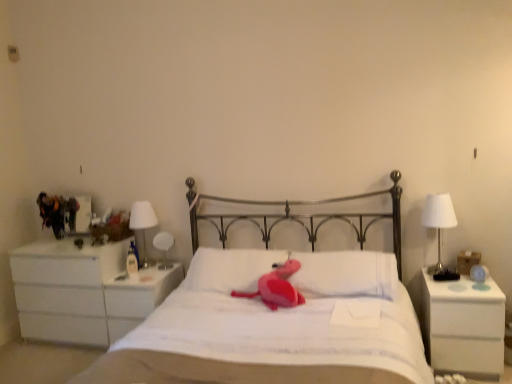
Question: Is white glossy table lamp at left outside white plastic nightstand at left, the 2th nightstand from the right?

Choices:
 (A) yes
 (B) no

Answer: (A)

Question: Are white glossy table lamp at left and white plastic nightstand at left, the 1th nightstand positioned from the left, making contact?

Choices:
 (A) no
 (B) yes

Answer: (A)

Question: From the image's perspective, is white glossy table lamp at left beneath white plastic nightstand at left, the 2th nightstand when ordered from front to back?

Choices:
 (A) no
 (B) yes

Answer: (A)

Question: Considering the relative sizes of white glossy table lamp at left and white plastic nightstand at left, the 2th nightstand when ordered from front to back, in the image provided, is white glossy table lamp at left bigger than white plastic nightstand at left, the 2th nightstand when ordered from front to back,?

Choices:
 (A) no
 (B) yes

Answer: (A)

Question: From the image's perspective, is white glossy table lamp at left on white plastic nightstand at left, which is the 1th nightstand from back to front?

Choices:
 (A) yes
 (B) no

Answer: (A)

Question: Considering the relative sizes of white glossy table lamp at left and white plastic nightstand at left, the 2th nightstand when ordered from front to back, in the image provided, is white glossy table lamp at left thinner than white plastic nightstand at left, the 2th nightstand when ordered from front to back,?

Choices:
 (A) yes
 (B) no

Answer: (A)

Question: Is white soft pillow at center, which is the first pillow in right-to-left order, to the right of white plastic nightstand at left, the 2th nightstand from the right, from the viewer's perspective?

Choices:
 (A) yes
 (B) no

Answer: (A)

Question: From a real-world perspective, is white soft pillow at center, which is the first pillow in right-to-left order, over white plastic nightstand at left, the 2th nightstand from the right?

Choices:
 (A) no
 (B) yes

Answer: (B)

Question: Does white soft pillow at center, which is the 2th pillow in left-to-right order, turn towards white plastic nightstand at left, the 2th nightstand when ordered from front to back?

Choices:
 (A) yes
 (B) no

Answer: (B)

Question: Is the position of white soft pillow at center, which is the first pillow in right-to-left order, more distant than that of white plastic nightstand at left, the 2th nightstand from the right?

Choices:
 (A) no
 (B) yes

Answer: (A)

Question: Is white soft pillow at center, which is the 2th pillow in left-to-right order, touching white plastic nightstand at left, the 1th nightstand positioned from the left?

Choices:
 (A) no
 (B) yes

Answer: (A)

Question: Does white soft pillow at center, which is the first pillow in right-to-left order, have a lesser width compared to white plastic nightstand at left, the 1th nightstand positioned from the left?

Choices:
 (A) yes
 (B) no

Answer: (A)

Question: Is matte pink plush at center at the left side of white soft pillow at center, positioned as the 1th pillow in left-to-right order?

Choices:
 (A) yes
 (B) no

Answer: (B)